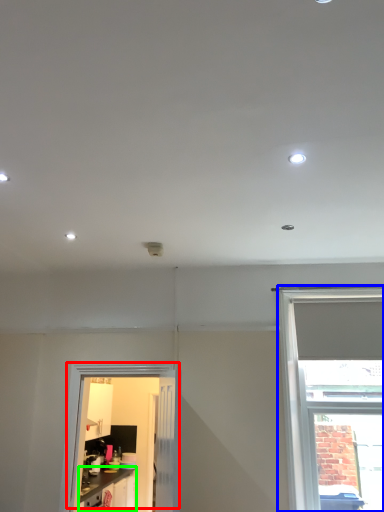
Question: Which object is the closest to the door (highlighted by a red box)? Choose among these: window (highlighted by a blue box) or cabinetry (highlighted by a green box).

Choices:
 (A) window
 (B) cabinetry

Answer: (B)